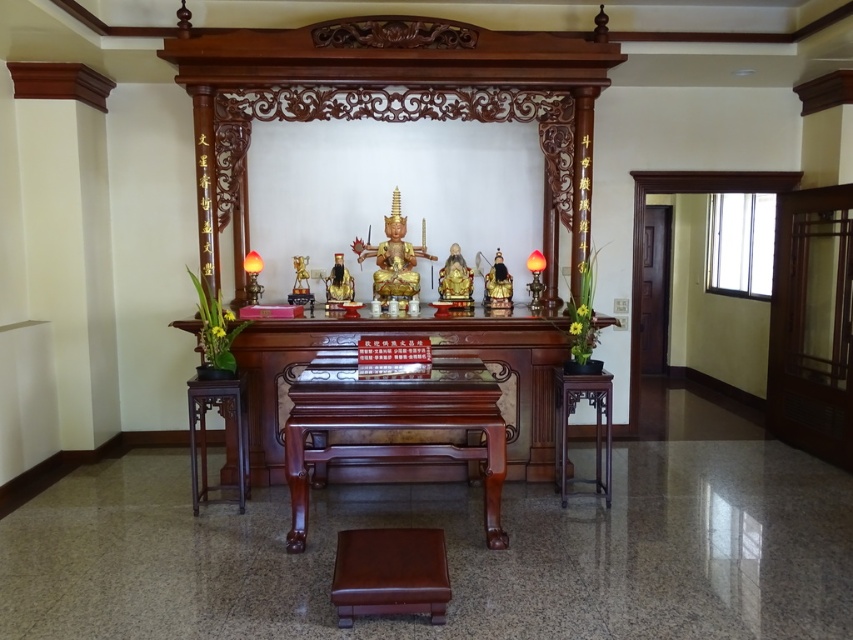
Question: Which of the following is the closest to the observer?

Choices:
 (A) brown leather stool at center
 (B) purple wood table at right

Answer: (A)

Question: Based on their relative distances, which object is nearer to the polished dark wood altar at center?

Choices:
 (A) matte red lamp at center
 (B) brown polished wood stool at lower left
 (C) purple wood table at right

Answer: (B)

Question: Is matte orange lamp at right positioned at the back of matte red lamp at center?

Choices:
 (A) yes
 (B) no

Answer: (A)

Question: Is brown leather stool at center thinner than purple wood table at right?

Choices:
 (A) no
 (B) yes

Answer: (B)

Question: Which of the following is the closest to the observer?

Choices:
 (A) matte red lamp at center
 (B) brown polished wood stool at lower left
 (C) matte orange lamp at right

Answer: (B)

Question: From the image, what is the correct spatial relationship of brown polished wood stool at lower left in relation to matte red lamp at center?

Choices:
 (A) below
 (B) above

Answer: (A)